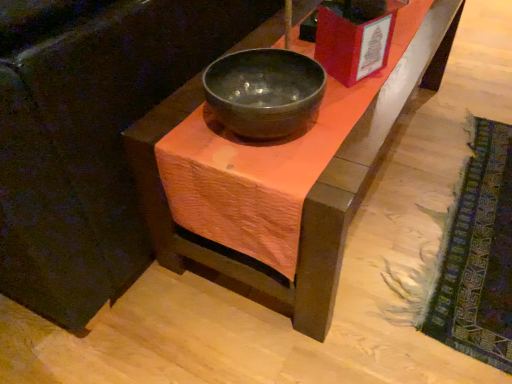
You are a GUI agent. You are given a task and a screenshot of the screen. Output one action in this format:
    pyautogui.click(x=<x>, y=<y>)
    Task: Click on the free spot in front of matte black bowl at center
    The image size is (512, 384).
    Given the screenshot: What is the action you would take?
    pyautogui.click(x=284, y=175)